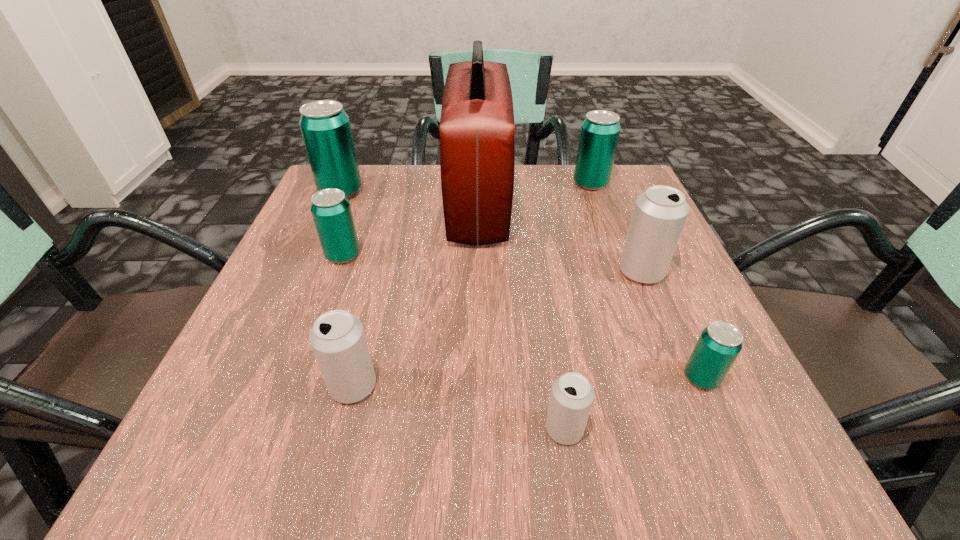
Find the location of `red first aid kit`. red first aid kit is located at coordinates (477, 130).

You are a GUI agent. You are given a task and a screenshot of the screen. Output one action in this format:
    pyautogui.click(x=<x>, y=<y>)
    Task: Click on the fourth object from left to right
    
    Given the screenshot: What is the action you would take?
    pyautogui.click(x=477, y=130)

The height and width of the screenshot is (540, 960). Find the location of `the tallest beer can`. the tallest beer can is located at coordinates (325, 127).

In order to click on the second tallest object in this screenshot , I will do `click(325, 127)`.

In order to click on the third smallest teal beer can in this screenshot , I will do `click(599, 135)`.

At what (x,y) coordinates should I click in order to perform the action: click on the biggest white beer can. Please return your answer as a coordinate pair (x, y). This screenshot has width=960, height=540. Looking at the image, I should click on pos(659,215).

At what (x,y) coordinates should I click in order to perform the action: click on the farthest white beer can. Please return your answer as a coordinate pair (x, y). Looking at the image, I should click on (659, 215).

Where is `the leftmost white beer can`? This screenshot has width=960, height=540. the leftmost white beer can is located at coordinates (338, 340).

Identify the location of the fifth beer can from right to left. (338, 340).

Image resolution: width=960 pixels, height=540 pixels. Find the location of `the third biggest teal beer can`. the third biggest teal beer can is located at coordinates (331, 211).